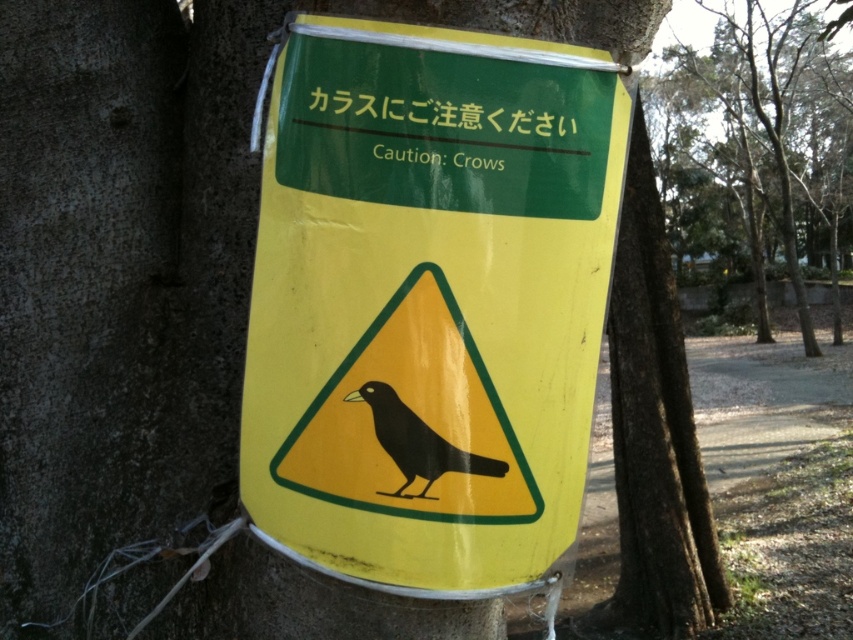
Question: Based on their relative distances, which object is farther from the black matte bird at center?

Choices:
 (A) yellow matte sign at center
 (B) smooth bark tree at upper right

Answer: (B)

Question: Is yellow matte sign at center wider than black matte bird at center?

Choices:
 (A) no
 (B) yes

Answer: (B)

Question: Which of these objects is positioned closest to the smooth bark tree at upper right?

Choices:
 (A) black matte bird at center
 (B) yellow matte sign at center

Answer: (B)

Question: Is yellow matte sign at center further to camera compared to smooth bark tree at upper right?

Choices:
 (A) yes
 (B) no

Answer: (B)

Question: Which object is positioned farthest from the black matte bird at center?

Choices:
 (A) smooth bark tree at upper right
 (B) yellow matte sign at center

Answer: (A)

Question: Is smooth bark tree at upper right below black matte bird at center?

Choices:
 (A) yes
 (B) no

Answer: (B)